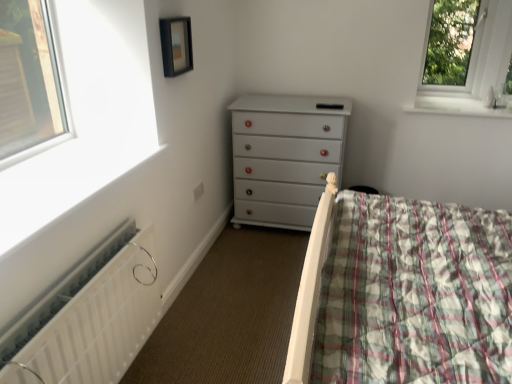
Question: Is matte black picture frame at upper center taller than white glossy window sill at upper right?

Choices:
 (A) yes
 (B) no

Answer: (A)

Question: Considering the relative sizes of matte black picture frame at upper center and white glossy window sill at upper right in the image provided, is matte black picture frame at upper center wider than white glossy window sill at upper right?

Choices:
 (A) yes
 (B) no

Answer: (B)

Question: Does matte black picture frame at upper center lie behind white glossy window sill at upper right?

Choices:
 (A) no
 (B) yes

Answer: (A)

Question: From the image's perspective, is matte black picture frame at upper center over white glossy window sill at upper right?

Choices:
 (A) no
 (B) yes

Answer: (B)

Question: Is matte black picture frame at upper center positioned with its back to white glossy window sill at upper right?

Choices:
 (A) no
 (B) yes

Answer: (A)

Question: Does matte black picture frame at upper center have a lesser height compared to white glossy window sill at upper right?

Choices:
 (A) yes
 (B) no

Answer: (B)

Question: From the image's perspective, is white painted wood chest of drawers at center under white glossy window sill at upper right?

Choices:
 (A) yes
 (B) no

Answer: (A)

Question: Is white glossy window sill at upper right a part of white painted wood chest of drawers at center?

Choices:
 (A) yes
 (B) no

Answer: (B)

Question: Does white painted wood chest of drawers at center lie behind white glossy window sill at upper right?

Choices:
 (A) yes
 (B) no

Answer: (B)

Question: Is white painted wood chest of drawers at center thinner than white glossy window sill at upper right?

Choices:
 (A) no
 (B) yes

Answer: (B)

Question: Considering the relative positions of white painted wood chest of drawers at center and white glossy window sill at upper right in the image provided, is white painted wood chest of drawers at center in front of white glossy window sill at upper right?

Choices:
 (A) no
 (B) yes

Answer: (B)

Question: Can we say white painted wood chest of drawers at center lies outside white glossy window sill at upper right?

Choices:
 (A) yes
 (B) no

Answer: (A)

Question: Is transparent glass window at upper right positioned in front of white glossy window sill at upper right?

Choices:
 (A) yes
 (B) no

Answer: (B)